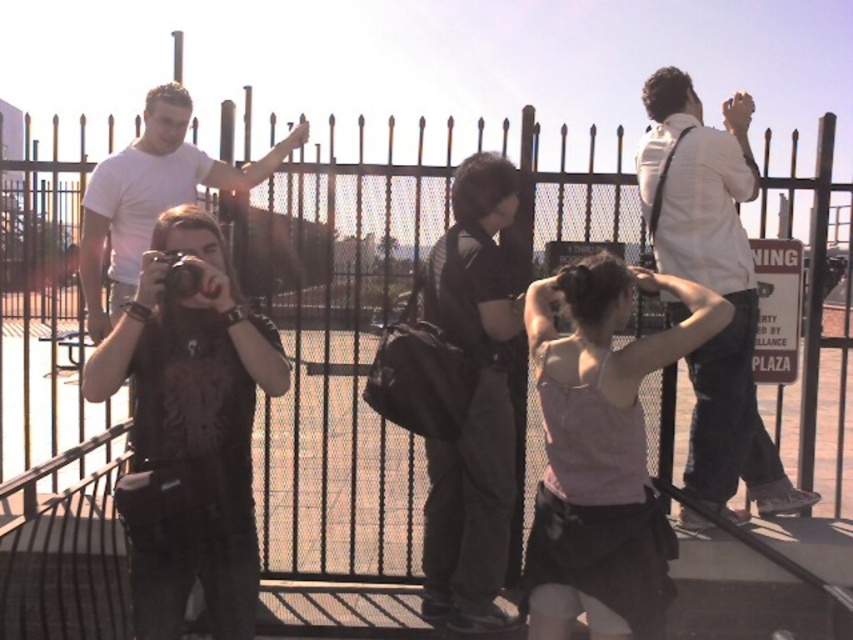
Question: Can you confirm if matte black shirt at center is positioned above matte black camera at center?

Choices:
 (A) no
 (B) yes

Answer: (A)

Question: Which point is closer to the camera?

Choices:
 (A) (508, 472)
 (B) (169, 202)
 (C) (148, 561)
 (D) (177, 276)

Answer: (D)

Question: Which point is closer to the camera taking this photo?

Choices:
 (A) pyautogui.click(x=692, y=410)
 (B) pyautogui.click(x=469, y=260)
 (C) pyautogui.click(x=183, y=216)
 (D) pyautogui.click(x=167, y=268)

Answer: (D)

Question: Which of the following is the farthest from the observer?

Choices:
 (A) (592, 589)
 (B) (700, 346)
 (C) (263, 332)

Answer: (B)

Question: Does black matte backpack at center appear on the right side of matte black camera at center?

Choices:
 (A) no
 (B) yes

Answer: (B)

Question: Does white shirt at upper right have a greater width compared to matte black camera at center?

Choices:
 (A) no
 (B) yes

Answer: (B)